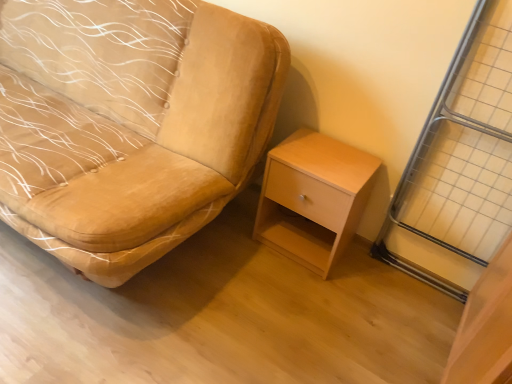
In order to click on free space that is to the left of light wood/finely finished nightstand at lower right in this screenshot , I will do `click(231, 242)`.